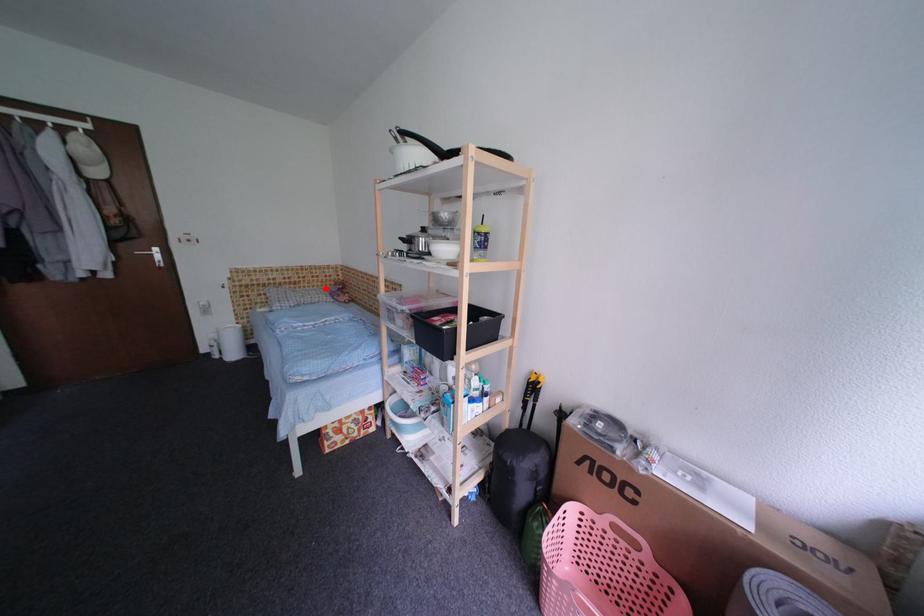
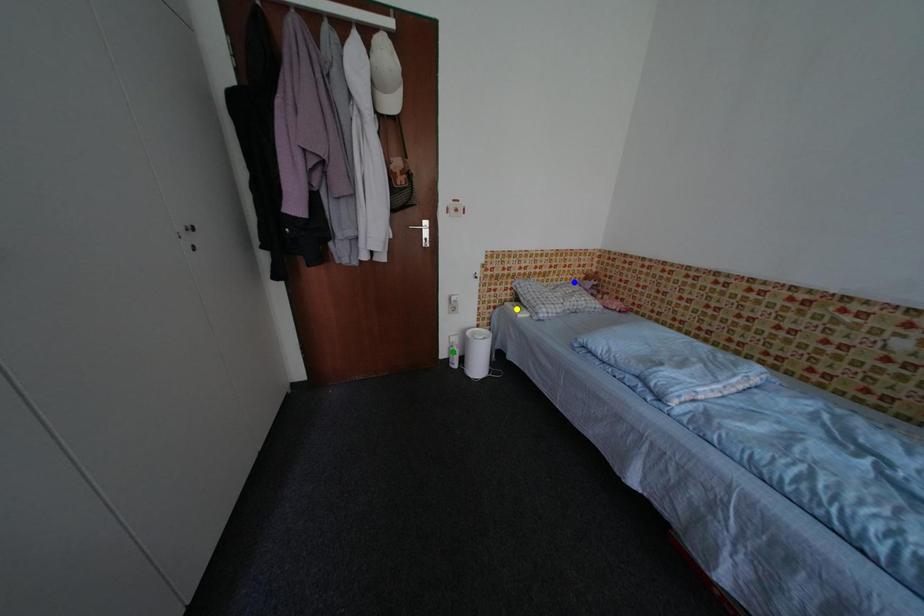
Question: I am providing you with two images of the same scene from different viewpoints. A red point is marked on the first image. You are given multiple points on the second image. In image 2, which mark is for the same physical point as the one in image 1?

Choices:
 (A) blue point
 (B) yellow point
 (C) green point

Answer: (A)